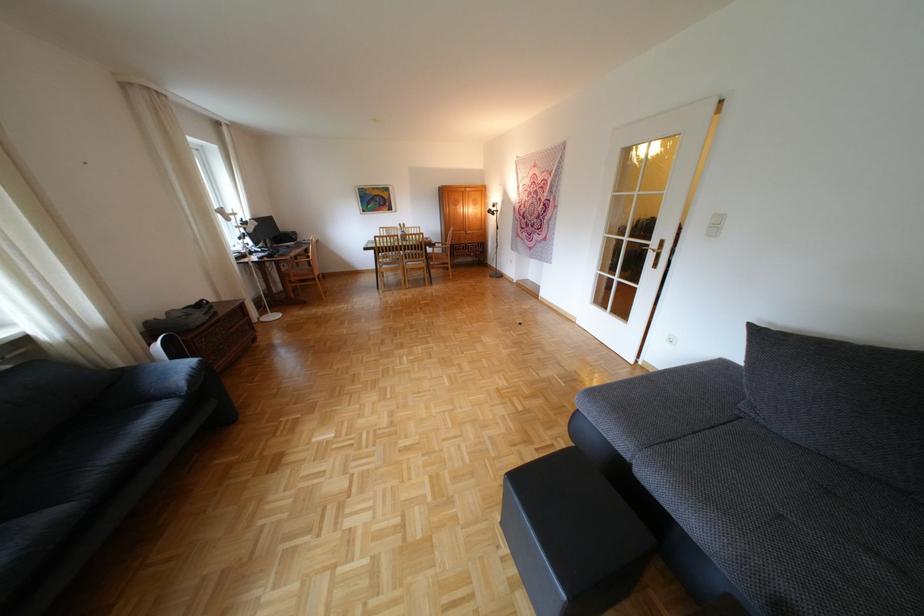
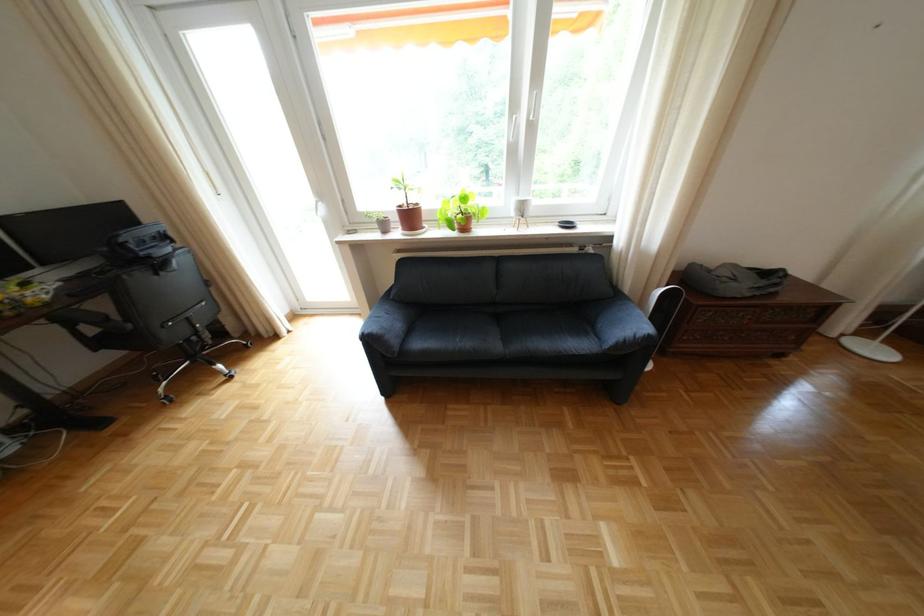
First-person continuous shooting, in which direction is the camera rotating?

The camera rotated toward left-down.